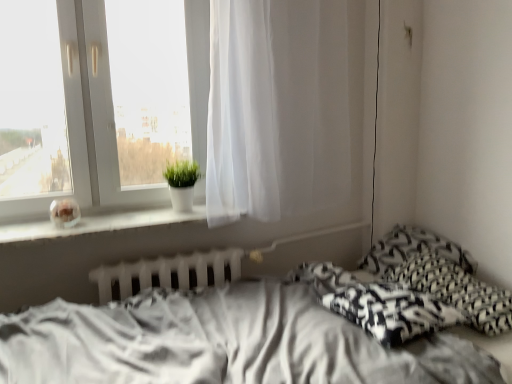
Locate an element on the screen. free space in front of black and white woven blanket at lower right is located at coordinates (422, 357).